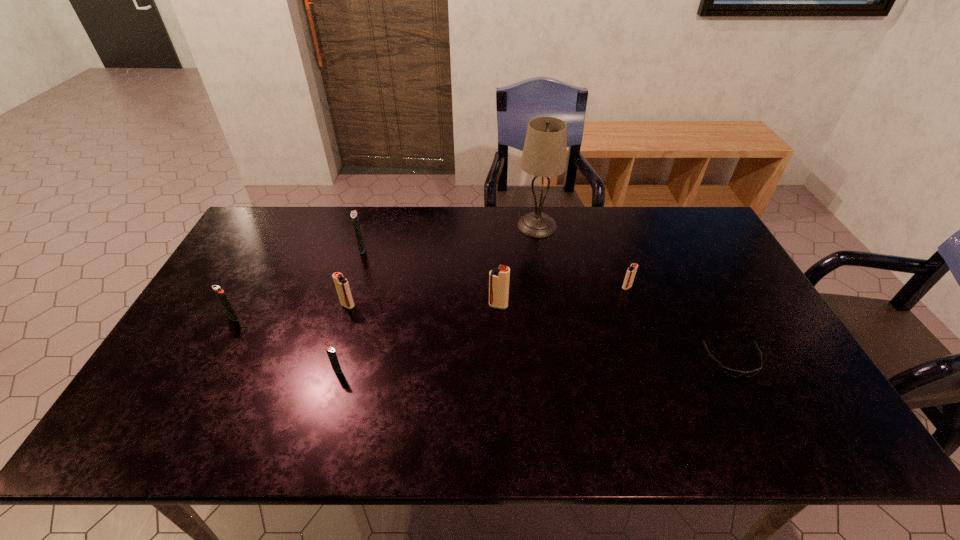
Locate an element on the screen. The image size is (960, 540). the smallest red igniter is located at coordinates (630, 274).

At what (x,y) coordinates should I click in order to perform the action: click on the rightmost black igniter. Please return your answer as a coordinate pair (x, y). Looking at the image, I should click on (331, 353).

Where is `the nearest igniter`? the nearest igniter is located at coordinates (331, 353).

Locate an element on the screen. This screenshot has height=540, width=960. sunglasses is located at coordinates (735, 373).

Locate an element on the screen. The image size is (960, 540). the shortest object is located at coordinates (735, 373).

In order to click on vacant space situated on the front-facing side of the lampshade in this screenshot , I will do `click(460, 226)`.

This screenshot has height=540, width=960. Find the location of `free location located on the front-facing side of the lampshade`. free location located on the front-facing side of the lampshade is located at coordinates (448, 226).

This screenshot has height=540, width=960. I want to click on free location located on the front-facing side of the lampshade, so click(x=493, y=226).

This screenshot has height=540, width=960. Find the location of `vacant region located 0.170m on the front of the biggest red igniter`. vacant region located 0.170m on the front of the biggest red igniter is located at coordinates (500, 359).

Find the location of a particular element. This screenshot has height=540, width=960. free space located 0.200m on the back of the second black igniter from left to right is located at coordinates (373, 210).